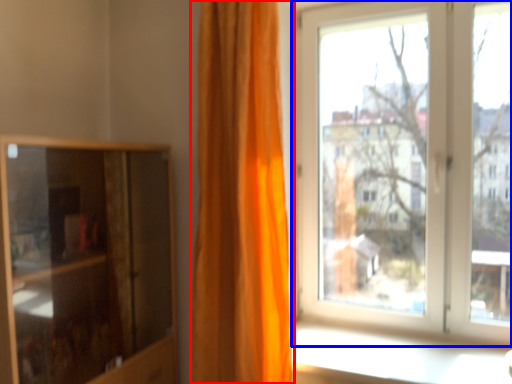
Question: Which of the following is the farthest to the observer, curtain (highlighted by a red box) or window (highlighted by a blue box)?

Choices:
 (A) curtain
 (B) window

Answer: (B)